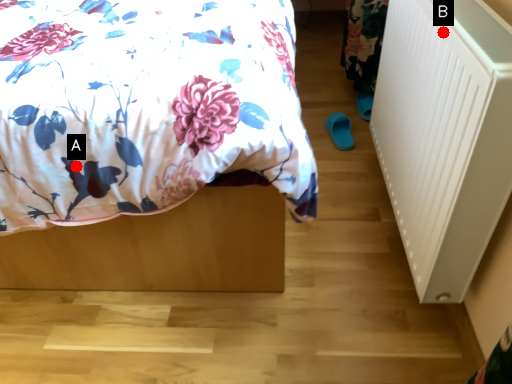
Question: Two points are circled on the image, labeled by A and B beside each circle. Which point appears farthest from the camera in this image?

Choices:
 (A) A is further
 (B) B is further

Answer: (A)